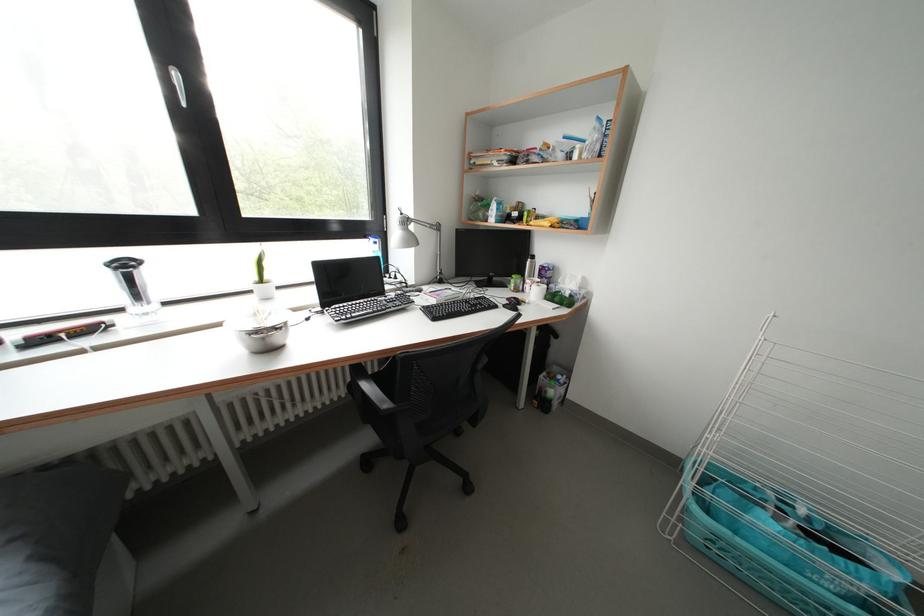
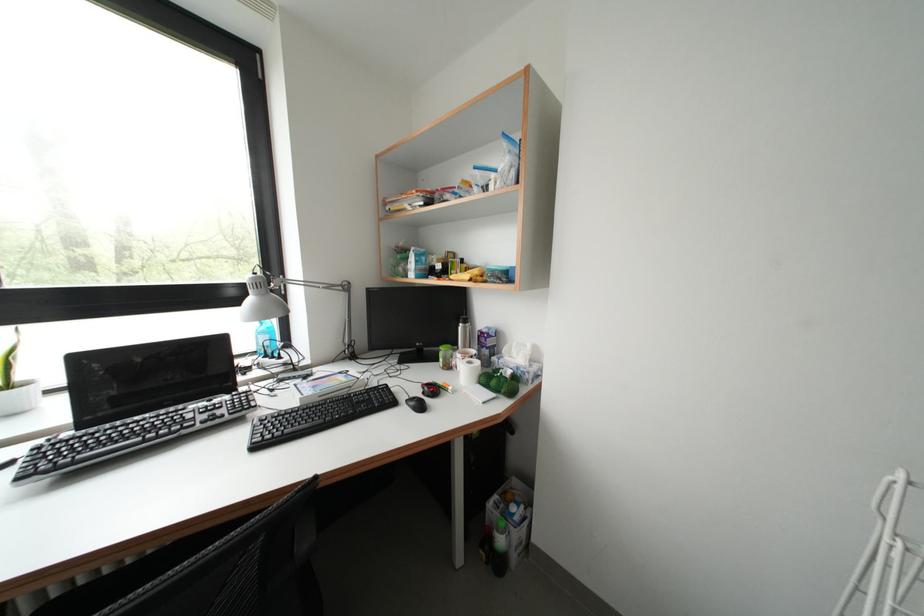
In the second image, find the point that corresponds to pixel 564 304 in the first image.

(500, 387)